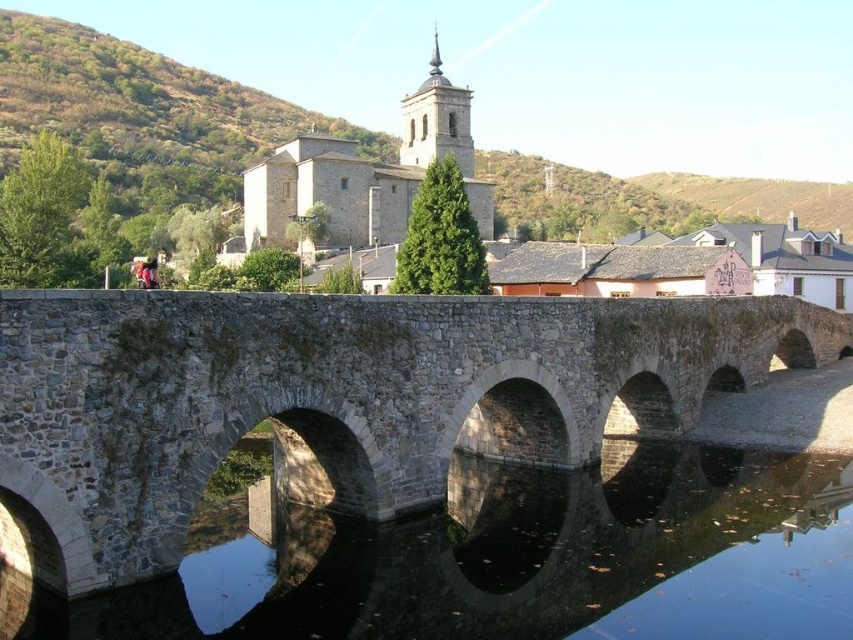
Does stone bridge at center appear on the left side of black stone water at center?

No, stone bridge at center is not to the left of black stone water at center.

Does point (537, 464) come in front of point (828, 579)?

No, (537, 464) is further to viewer.

The width and height of the screenshot is (853, 640). Identify the location of stone bridge at center. (335, 400).